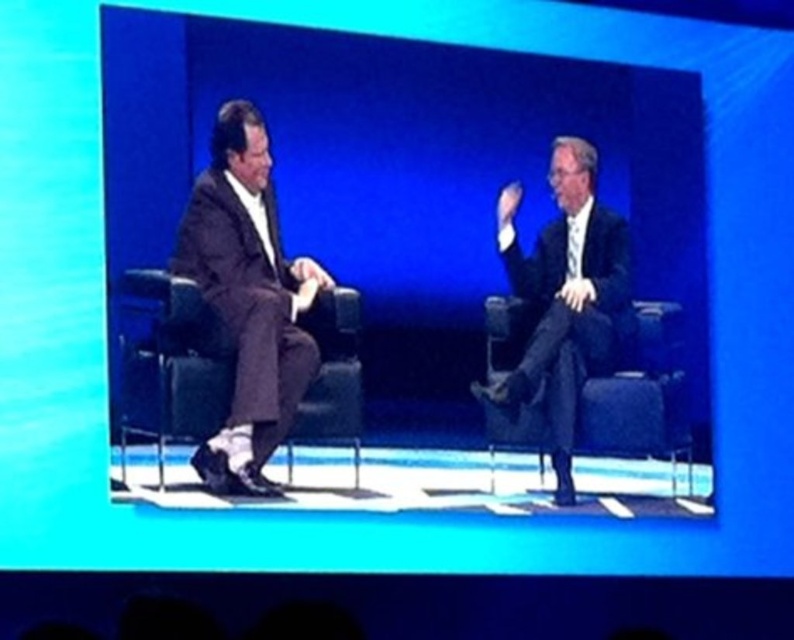
Question: Does dark suit at right appear on the left side of black leather chair at left?

Choices:
 (A) no
 (B) yes

Answer: (A)

Question: Which of the following is the farthest from the observer?

Choices:
 (A) (552, 376)
 (B) (237, 157)
 (C) (590, 241)
 (D) (172, 314)

Answer: (C)

Question: Which point is farther from the camera taking this photo?

Choices:
 (A) (584, 269)
 (B) (216, 477)

Answer: (A)

Question: Which is nearer to the black leather chair at left?

Choices:
 (A) dark suit at right
 (B) dark brown suit at left

Answer: (B)

Question: Is dark suit at right thinner than black leather chair at left?

Choices:
 (A) no
 (B) yes

Answer: (A)

Question: Does dark suit at right have a smaller size compared to dark blue fabric chair at right?

Choices:
 (A) no
 (B) yes

Answer: (A)